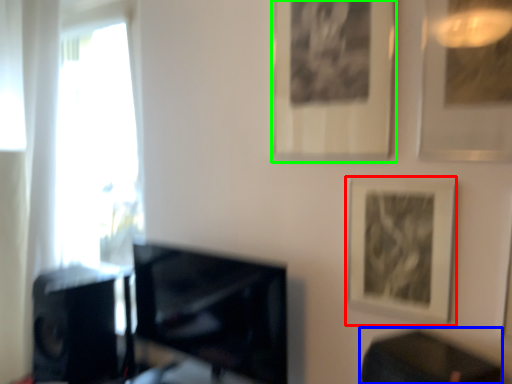
Question: Which object is the closest to the picture frame (highlighted by a red box)? Choose among these: table (highlighted by a blue box) or picture frame (highlighted by a green box).

Choices:
 (A) table
 (B) picture frame

Answer: (A)